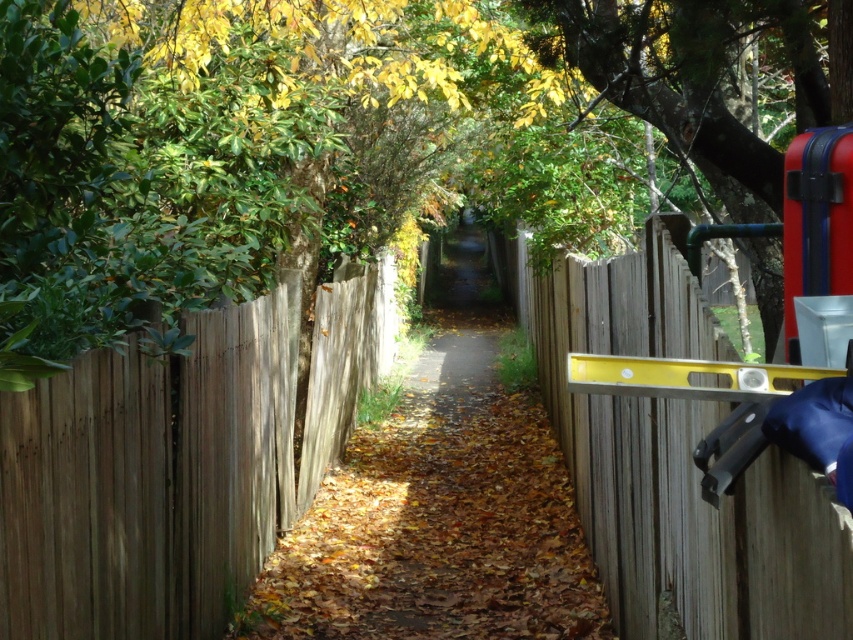
Does brown wooden path at center appear over green leafy tree at upper right?

Incorrect, brown wooden path at center is not positioned above green leafy tree at upper right.

Which is above, brown wooden path at center or green leafy tree at upper right?

Positioned higher is green leafy tree at upper right.

Identify the location of brown wooden path at center. (440, 499).

Find the location of a particular element. The image size is (853, 640). brown wooden path at center is located at coordinates (440, 499).

Does brown wooden fence at left have a smaller size compared to yellow metallic level at right?

Actually, brown wooden fence at left might be larger than yellow metallic level at right.

Is point (138, 593) farther from viewer compared to point (628, 387)?

Yes, it is behind point (628, 387).

Locate an element on the screen. This screenshot has height=640, width=853. brown wooden fence at left is located at coordinates (177, 465).

Identify the location of brown wooden path at center. This screenshot has width=853, height=640. (440, 499).

Is brown wooden path at center above yellow metallic level at right?

Incorrect, brown wooden path at center is not positioned above yellow metallic level at right.

Who is more distant from viewer, (534, 627) or (790, 390)?

Positioned behind is point (534, 627).

You are a GUI agent. You are given a task and a screenshot of the screen. Output one action in this format:
    pyautogui.click(x=<x>, y=<y>)
    Task: Click on the brown wooden path at center
    
    Given the screenshot: What is the action you would take?
    [x=440, y=499]